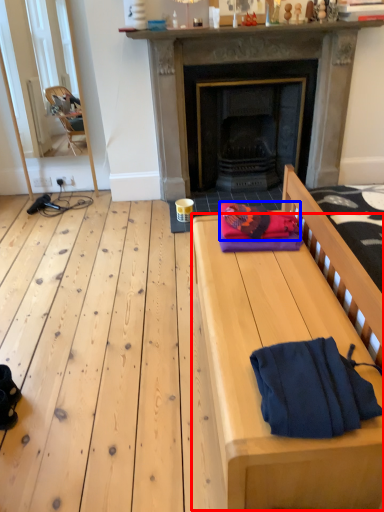
Question: Which object is closer to the camera taking this photo, table (highlighted by a red box) or blanket (highlighted by a blue box)?

Choices:
 (A) table
 (B) blanket

Answer: (A)